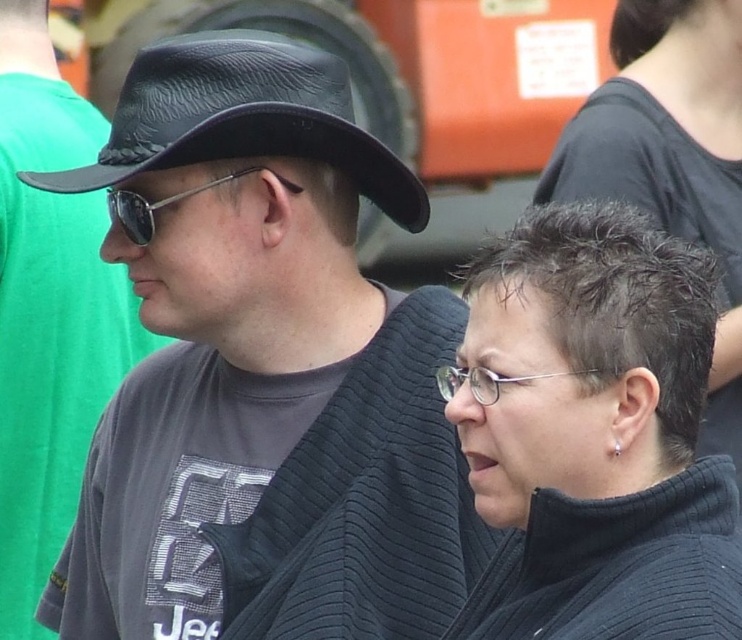
Who is positioned more to the left, black matte hair at center or black leather fedora at left?

black leather fedora at left is more to the left.

From the picture: Does black matte hair at center come in front of black leather fedora at left?

No, black matte hair at center is behind black leather fedora at left.

This screenshot has height=640, width=742. Describe the element at coordinates (672, 157) in the screenshot. I see `black matte hair at center` at that location.

The width and height of the screenshot is (742, 640). In order to click on black matte hair at center in this screenshot , I will do `click(672, 157)`.

Is black knit sweater at lower right further to the viewer compared to matte black hat at left?

No, it is in front of matte black hat at left.

Can you confirm if black knit sweater at lower right is positioned above matte black hat at left?

Incorrect, black knit sweater at lower right is not positioned above matte black hat at left.

Where is `black knit sweater at lower right`? The width and height of the screenshot is (742, 640). black knit sweater at lower right is located at coordinates (594, 433).

This screenshot has width=742, height=640. I want to click on black knit sweater at lower right, so click(x=594, y=433).

Can you confirm if matte black hat at left is smaller than black leather fedora at left?

Incorrect, matte black hat at left is not smaller in size than black leather fedora at left.

Between point (111, 339) and point (315, 132), which one is positioned in front?

Point (315, 132) is in front.

The width and height of the screenshot is (742, 640). What do you see at coordinates (49, 314) in the screenshot?
I see `matte black hat at left` at bounding box center [49, 314].

Locate an element on the screen. The width and height of the screenshot is (742, 640). matte black hat at left is located at coordinates (49, 314).